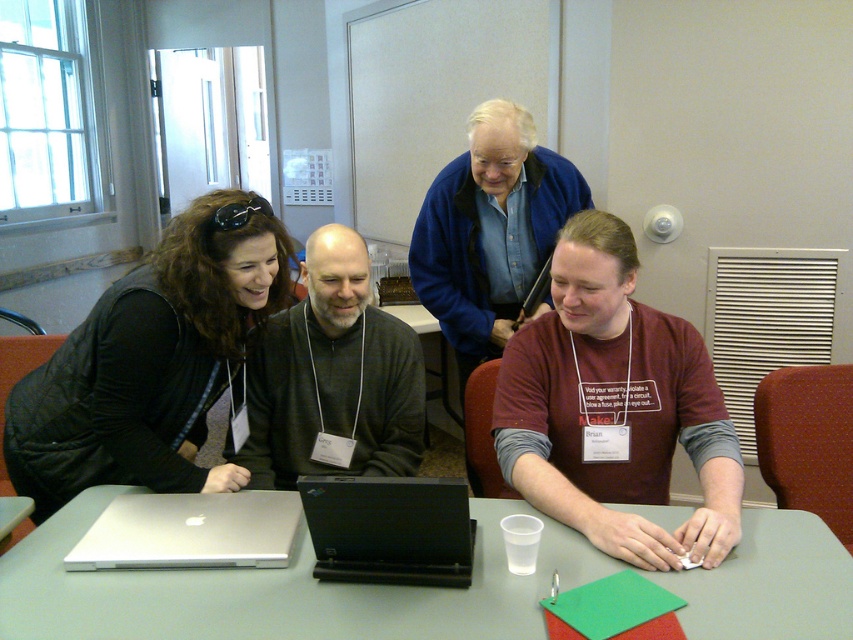
Question: Estimate the real-world distances between objects in this image. Which object is farther from the maroon cotton shirt at center?

Choices:
 (A) blue wool sweater at upper center
 (B) smooth gray table at center
 (C) matte black jacket at left
 (D) black plastic laptop at center

Answer: (C)

Question: Is maroon cotton shirt at center positioned before silver metallic laptop at center?

Choices:
 (A) no
 (B) yes

Answer: (B)

Question: Can you confirm if blue wool sweater at upper center is thinner than black plastic laptop at center?

Choices:
 (A) yes
 (B) no

Answer: (B)

Question: Which object is the closest to the smooth gray table at center?

Choices:
 (A) maroon cotton shirt at center
 (B) black plastic laptop at center

Answer: (B)

Question: Is black plastic laptop at center below silver metallic laptop at center?

Choices:
 (A) yes
 (B) no

Answer: (B)

Question: Which point appears farthest from the camera in this image?

Choices:
 (A) (289, 618)
 (B) (193, 262)
 (C) (204, 499)

Answer: (C)